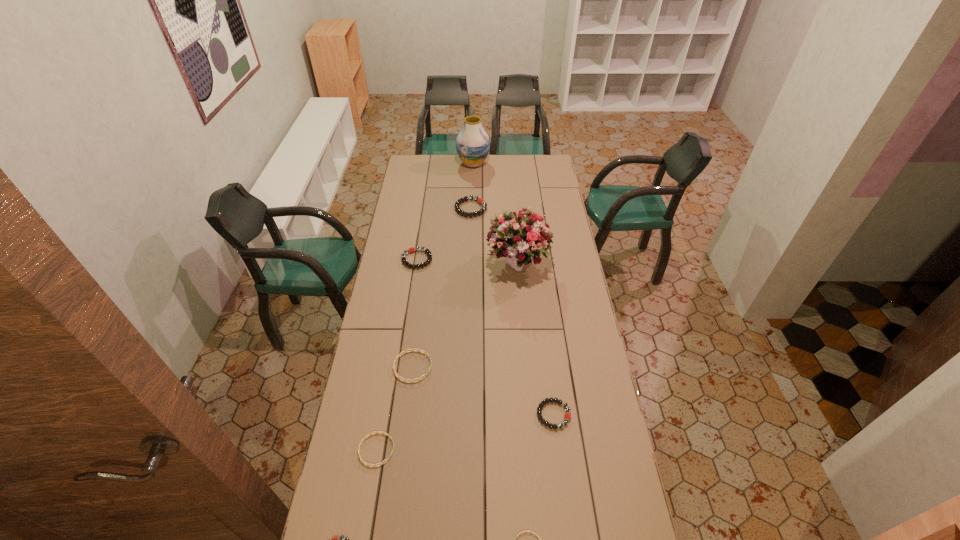
Where is `vacant position in the image that satisfies the following two spatial constraints: 1. on the surface of the biggest blue bracelet showing star-shaped elements; 2. on the back side of the fourth nearest object`? This screenshot has height=540, width=960. vacant position in the image that satisfies the following two spatial constraints: 1. on the surface of the biggest blue bracelet showing star-shaped elements; 2. on the back side of the fourth nearest object is located at coordinates pyautogui.click(x=406, y=415).

At what (x,y) coordinates should I click in order to perform the action: click on vacant space that satisfies the following two spatial constraints: 1. on the front side of the pink bouquet; 2. on the surface of the third farthest bracelet showing star-shaped elements. Please return your answer as a coordinate pair (x, y). The height and width of the screenshot is (540, 960). Looking at the image, I should click on (527, 367).

Image resolution: width=960 pixels, height=540 pixels. Find the location of `vacant space that satisfies the following two spatial constraints: 1. on the front side of the vase; 2. on the surface of the third nearest object showing star-shaped elements`. vacant space that satisfies the following two spatial constraints: 1. on the front side of the vase; 2. on the surface of the third nearest object showing star-shaped elements is located at coordinates [x=468, y=450].

Find the location of `free location that satisfies the following two spatial constraints: 1. on the surface of the fifth nearest object showing star-shaped elements; 2. on the back side of the second nearest black bracelet`. free location that satisfies the following two spatial constraints: 1. on the surface of the fifth nearest object showing star-shaped elements; 2. on the back side of the second nearest black bracelet is located at coordinates 406,415.